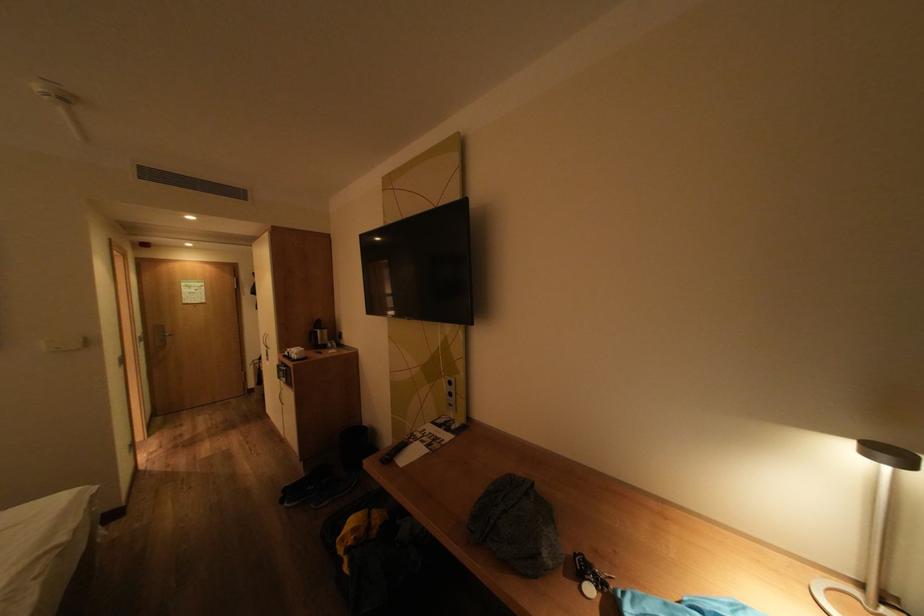
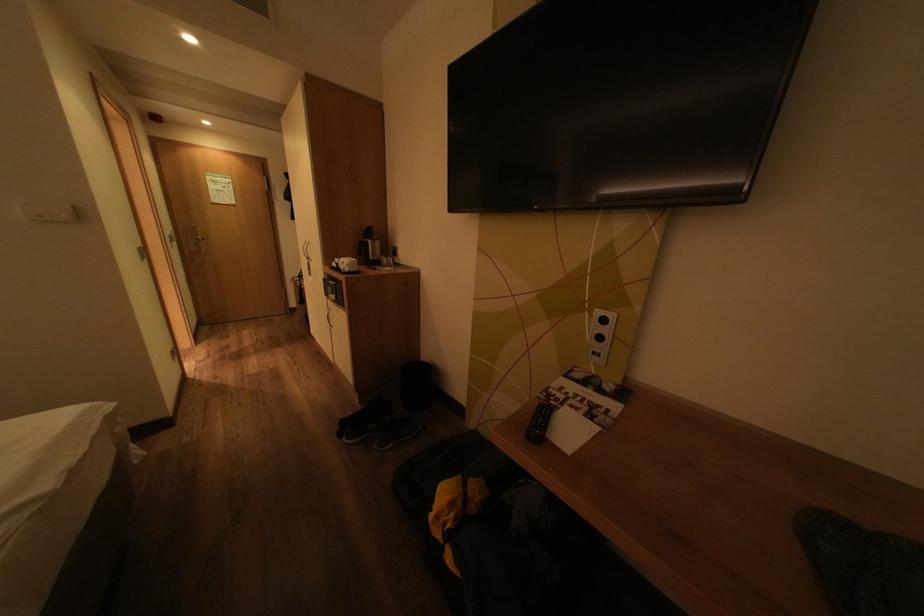
What movement of the cameraman would produce the second image?

The cameraman moved toward left, forward.